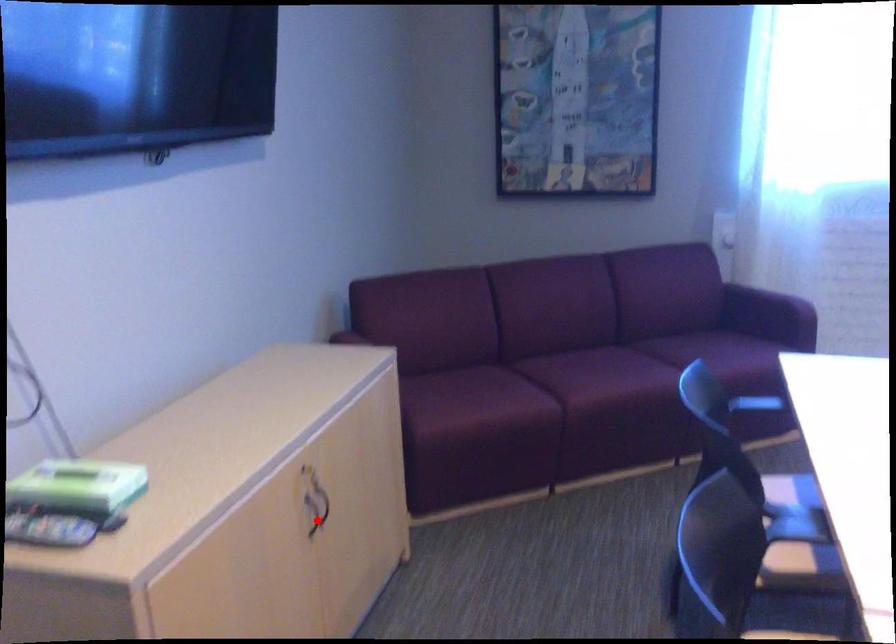
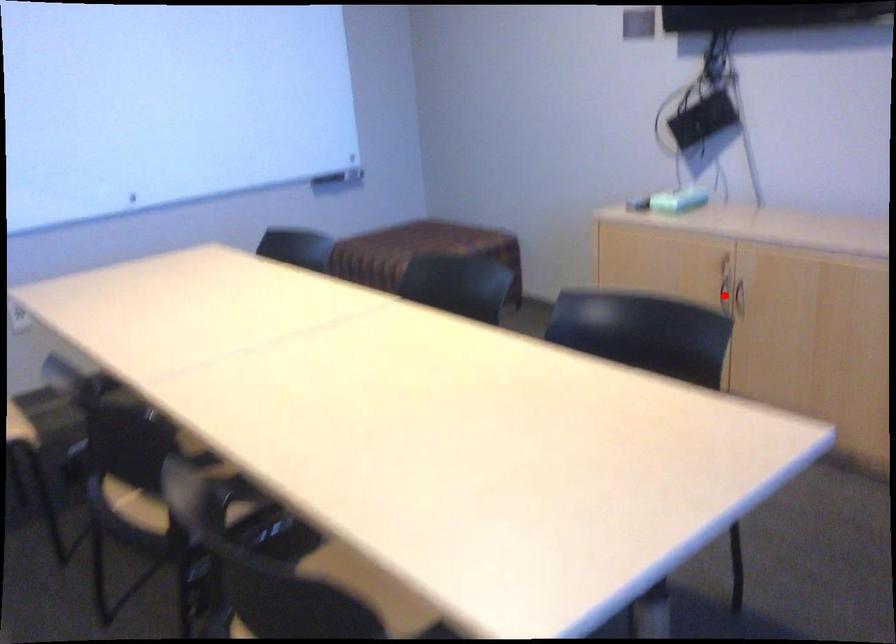
I am providing you with two images of the same scene from different viewpoints. A red point is marked on the first image and another point is marked on the second image. Does the point marked in image1 correspond to the same location as the one in image2?

No